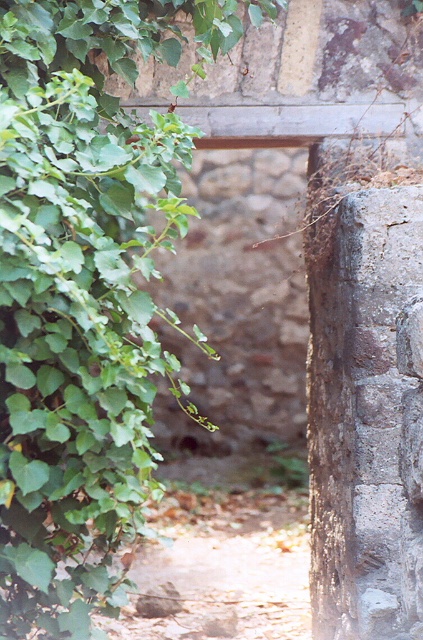
Question: Can you confirm if green leafy plant at left is positioned above brown dirt path at center?

Choices:
 (A) yes
 (B) no

Answer: (A)

Question: Among these points, which one is farthest from the camera?

Choices:
 (A) (87, 509)
 (B) (170, 580)

Answer: (B)

Question: Which object is farther from the camera taking this photo?

Choices:
 (A) brown dirt path at center
 (B) green leafy plant at left

Answer: (A)

Question: Is green leafy plant at left below brown dirt path at center?

Choices:
 (A) no
 (B) yes

Answer: (A)

Question: Which of the following is the closest to the observer?

Choices:
 (A) brown dirt path at center
 (B) green leafy plant at left

Answer: (B)

Question: Does green leafy plant at left have a larger size compared to brown dirt path at center?

Choices:
 (A) yes
 (B) no

Answer: (A)